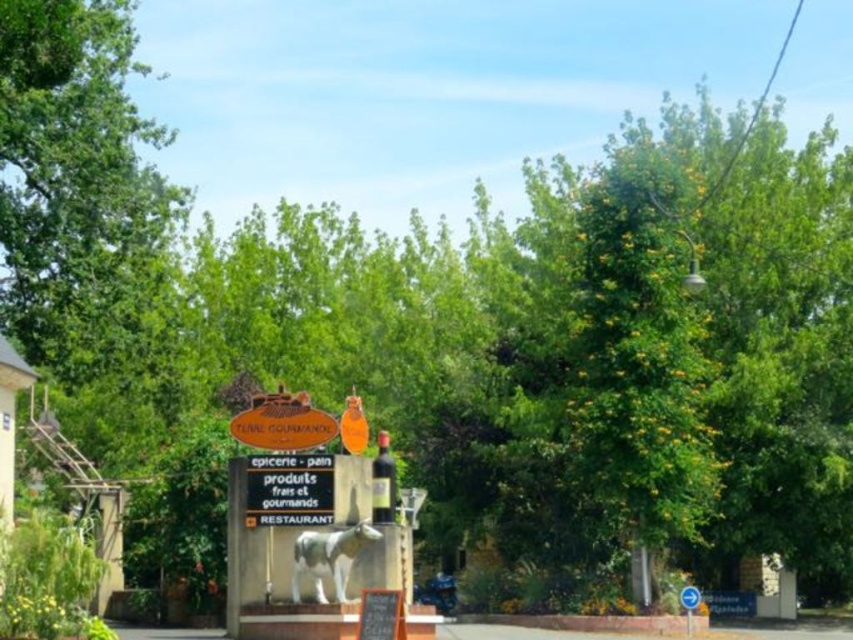
Between orange wood sign at center and white plastic sign at lower right, which one appears on the left side from the viewer's perspective?

Positioned to the left is orange wood sign at center.

Is orange wood sign at center shorter than white plastic sign at lower right?

Yes.

Where is `orange wood sign at center`? This screenshot has height=640, width=853. orange wood sign at center is located at coordinates coord(282,422).

Can you confirm if black plastic sign at center is shorter than white plastic sign at lower right?

In fact, black plastic sign at center may be taller than white plastic sign at lower right.

You are a GUI agent. You are given a task and a screenshot of the screen. Output one action in this format:
    pyautogui.click(x=<x>, y=<y>)
    Task: Click on the black plastic sign at center
    Image resolution: width=853 pixels, height=640 pixels.
    Given the screenshot: What is the action you would take?
    pyautogui.click(x=289, y=490)

Where is `black plastic sign at center`? black plastic sign at center is located at coordinates (289, 490).

Describe the element at coordinates (289, 490) in the screenshot. Image resolution: width=853 pixels, height=640 pixels. I see `black plastic sign at center` at that location.

Is black plastic sign at center bigger than orange wood sign at center?

Actually, black plastic sign at center might be smaller than orange wood sign at center.

Is point (302, 464) positioned before point (231, 422)?

That is True.

You are a GUI agent. You are given a task and a screenshot of the screen. Output one action in this format:
    pyautogui.click(x=<x>, y=<y>)
    Task: Click on the black plastic sign at center
    The width and height of the screenshot is (853, 640).
    Given the screenshot: What is the action you would take?
    pyautogui.click(x=289, y=490)